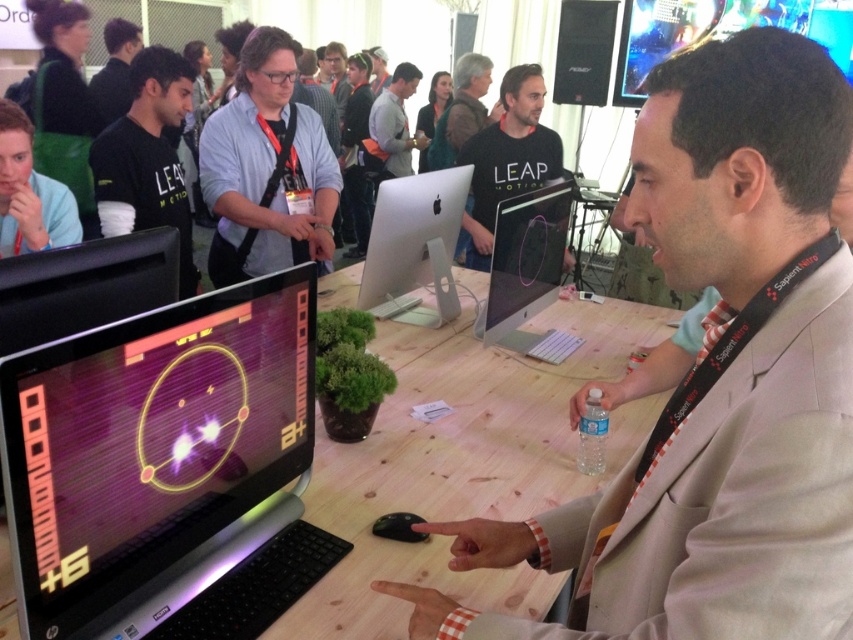
Question: Is wooden table at center further to the viewer compared to dark gray shirt at upper left?

Choices:
 (A) yes
 (B) no

Answer: (B)

Question: Estimate the real-world distances between objects in this image. Which object is closer to the dark gray shirt at upper left?

Choices:
 (A) black matte shirt at center
 (B) wooden table at center
 (C) black matte shirt at left
 (D) gray fabric shirt at center

Answer: (C)

Question: Which object is positioned closest to the black matte shirt at center?

Choices:
 (A) black glossy laptop at center
 (B) black glossy monitor at center
 (C) beige suit at center

Answer: (B)

Question: Which object is the farthest from the black matte shirt at left?

Choices:
 (A) dark gray shirt at upper left
 (B) beige suit at center
 (C) black glossy monitor at center

Answer: (B)

Question: Does black glossy monitor at center have a smaller size compared to sleek silver monitor at center?

Choices:
 (A) no
 (B) yes

Answer: (B)

Question: Does beige suit at center appear on the right side of shiny plastic monitor at upper right?

Choices:
 (A) no
 (B) yes

Answer: (A)